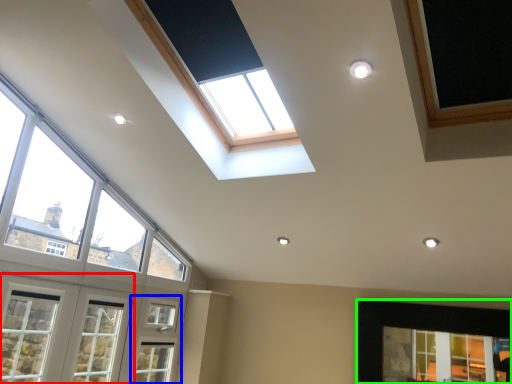
Question: Which object is the closest to the window (highlighted by a red box)? Choose among these: screen door (highlighted by a blue box) or window (highlighted by a green box).

Choices:
 (A) screen door
 (B) window

Answer: (A)